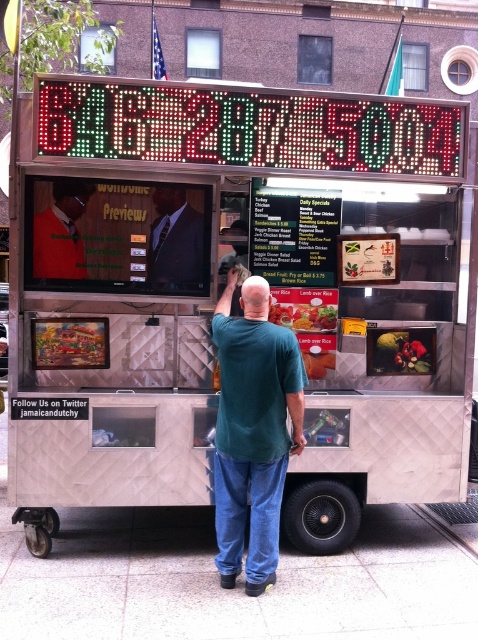
Who is taller, green matte shirt at center or smooth plastic fruit at center?

green matte shirt at center is taller.

Does green matte shirt at center have a lesser height compared to smooth plastic fruit at center?

Incorrect, green matte shirt at center's height does not fall short of smooth plastic fruit at center's.

Who is more forward, [258,403] or [427,348]?

Positioned in front is point [258,403].

Locate an element on the screen. green matte shirt at center is located at coordinates [x=252, y=432].

Between green matte shirt at center and smooth plastic tray at center, which one is positioned higher?

smooth plastic tray at center

Can you confirm if green matte shirt at center is bigger than smooth plastic tray at center?

Indeed, green matte shirt at center has a larger size compared to smooth plastic tray at center.

Who is more distant from viewer, [303,376] or [324,310]?

The point [324,310] is behind.

At what (x,y) coordinates should I click in order to perform the action: click on green matte shirt at center. Please return your answer as a coordinate pair (x, y). The image size is (478, 640). Looking at the image, I should click on (252, 432).

Is point (402, 305) more distant than point (279, 444)?

Yes, it is.

Identify the location of metallic silver food truck at center. (215, 300).